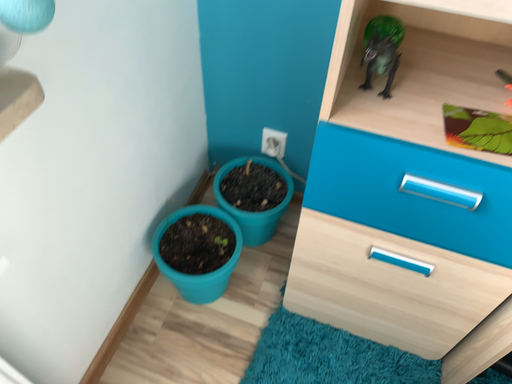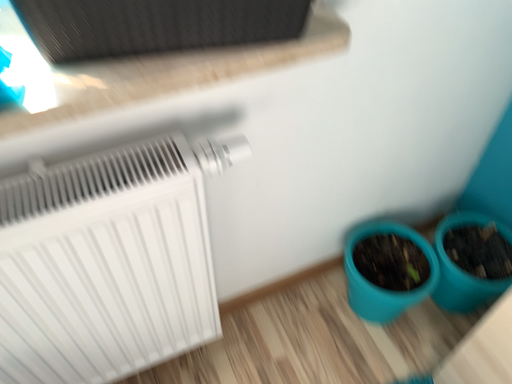
Question: Which way did the camera rotate in the video?

Choices:
 (A) rotated upward
 (B) rotated downward

Answer: (A)